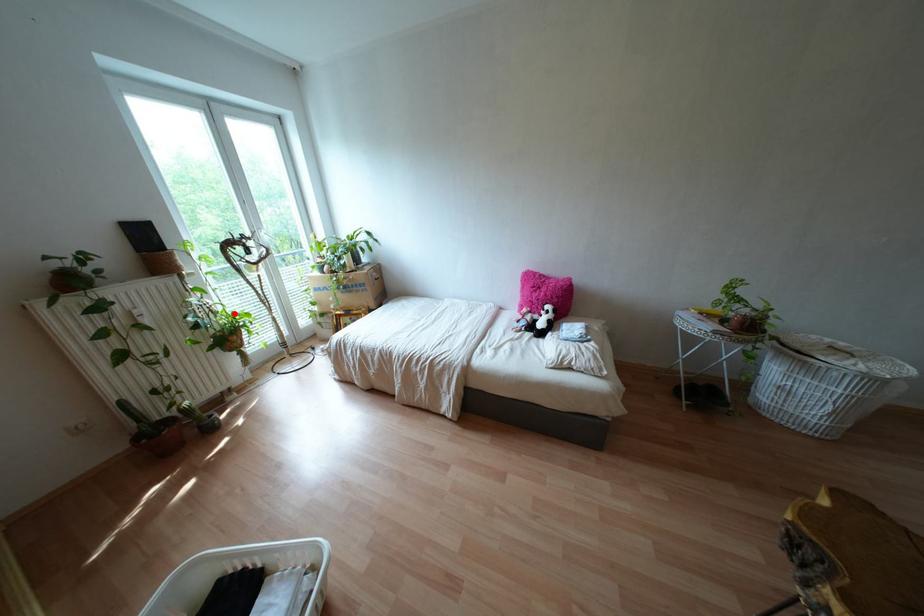
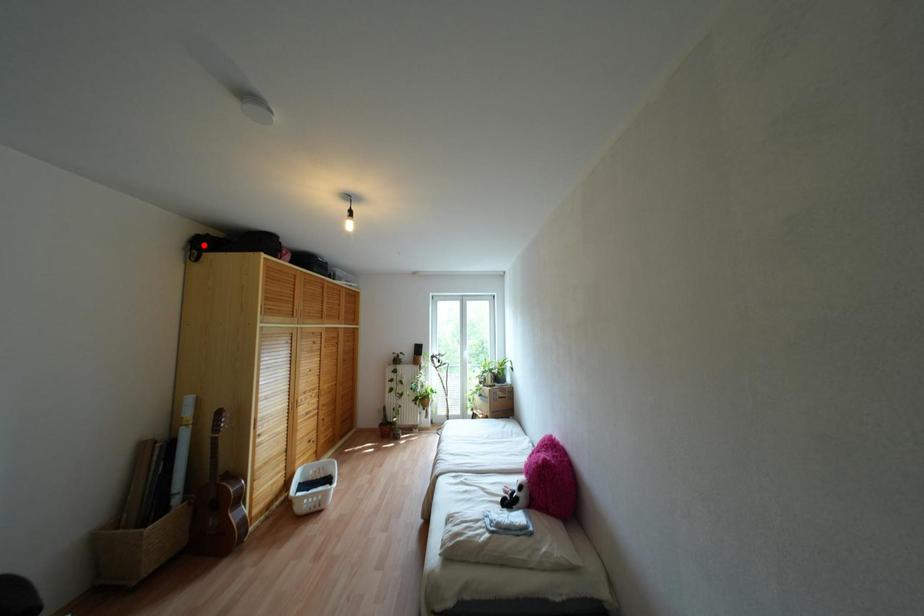
I am providing you with two images of the same scene from different viewpoints. A red point is marked on the first image and another point is marked on the second image. Are the points marked in image1 and image2 representing the same 3D position?

No